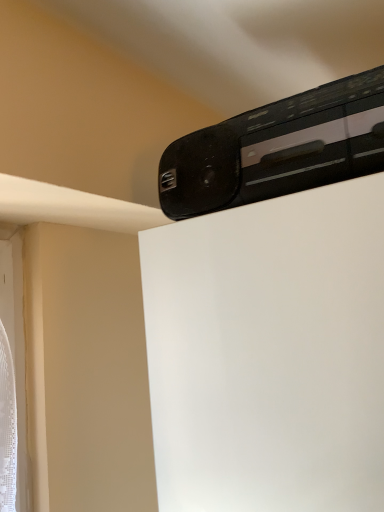
Describe the element at coordinates (278, 149) in the screenshot. I see `black matte phone at upper center` at that location.

Identify the location of black matte phone at upper center. (278, 149).

The height and width of the screenshot is (512, 384). I want to click on black matte phone at upper center, so click(278, 149).